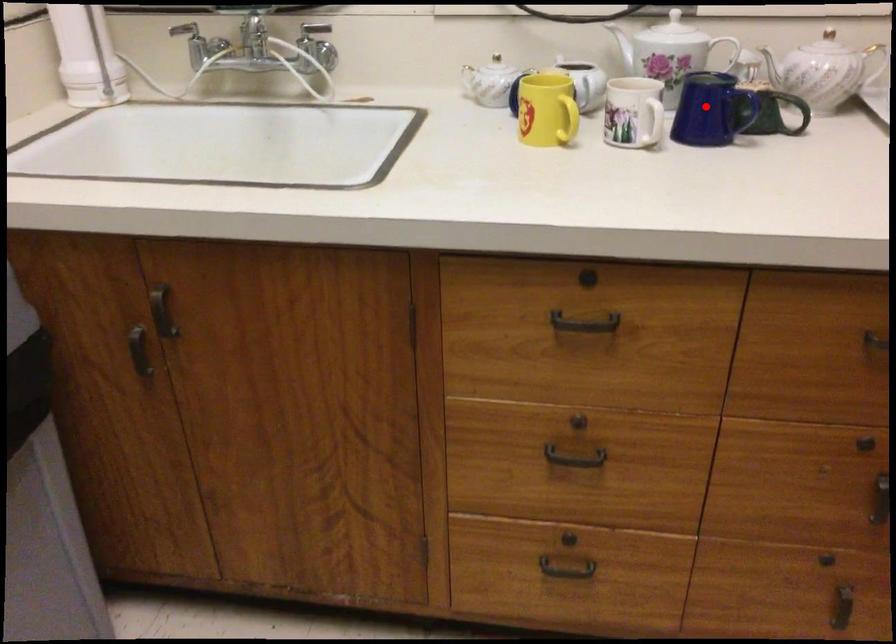
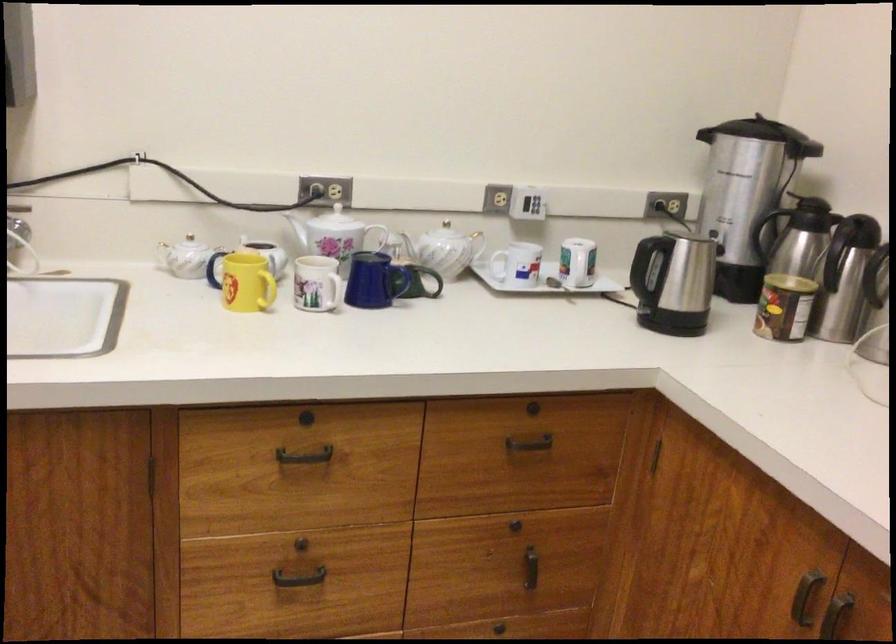
In the second image, find the point that corresponds to the highlighted location in the first image.

(375, 281)